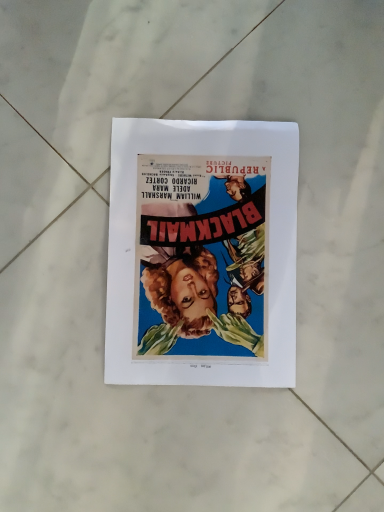
I want to click on free spot above matte paper poster at center (from a real-world perspective), so [x=205, y=254].